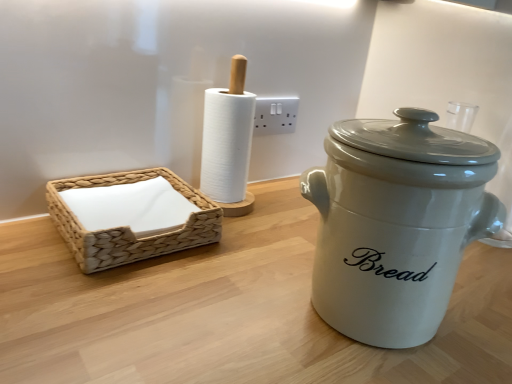
Question: From the image's perspective, does white plastic electric outlet at center appear higher than white ceramic crock pot at right?

Choices:
 (A) yes
 (B) no

Answer: (A)

Question: Is white plastic electric outlet at center smaller than white ceramic crock pot at right?

Choices:
 (A) no
 (B) yes

Answer: (B)

Question: Is white plastic electric outlet at center not inside white ceramic crock pot at right?

Choices:
 (A) no
 (B) yes

Answer: (B)

Question: Can you confirm if white plastic electric outlet at center is shorter than white ceramic crock pot at right?

Choices:
 (A) no
 (B) yes

Answer: (B)

Question: From the image's perspective, is white plastic electric outlet at center located beneath white ceramic crock pot at right?

Choices:
 (A) yes
 (B) no

Answer: (B)

Question: Is point (74, 216) closer or farther from the camera than point (376, 319)?

Choices:
 (A) closer
 (B) farther

Answer: (B)

Question: Considering the positions of woven beige basket at left and white ceramic crock pot at right in the image, is woven beige basket at left wider or thinner than white ceramic crock pot at right?

Choices:
 (A) wide
 (B) thin

Answer: (A)

Question: Relative to white ceramic crock pot at right, is woven beige basket at left in front or behind?

Choices:
 (A) front
 (B) behind

Answer: (B)

Question: Would you say woven beige basket at left is to the left or to the right of white ceramic crock pot at right in the picture?

Choices:
 (A) left
 (B) right

Answer: (A)

Question: Is white plastic electric outlet at center wider or thinner than woven beige basket at left?

Choices:
 (A) thin
 (B) wide

Answer: (A)

Question: From the image's perspective, relative to woven beige basket at left, is white plastic electric outlet at center above or below?

Choices:
 (A) above
 (B) below

Answer: (A)

Question: Considering their positions, is white plastic electric outlet at center located in front of or behind woven beige basket at left?

Choices:
 (A) behind
 (B) front

Answer: (A)

Question: Is white plastic electric outlet at center inside or outside of woven beige basket at left?

Choices:
 (A) inside
 (B) outside

Answer: (B)

Question: From the image's perspective, is white plastic electric outlet at center positioned above or below white ceramic crock pot at right?

Choices:
 (A) above
 (B) below

Answer: (A)

Question: In the image, is white plastic electric outlet at center positioned in front of or behind white ceramic crock pot at right?

Choices:
 (A) front
 (B) behind

Answer: (B)